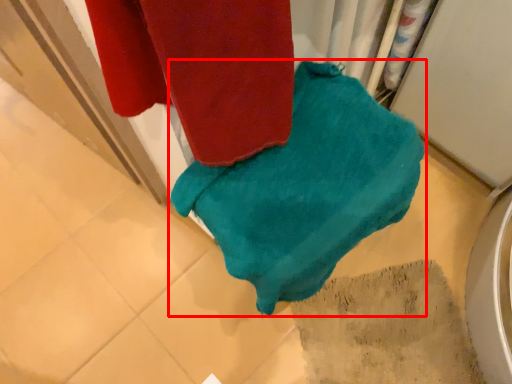
Question: From the image's perspective, where is towel (annotated by the red box) located relative to tile?

Choices:
 (A) below
 (B) above

Answer: (B)